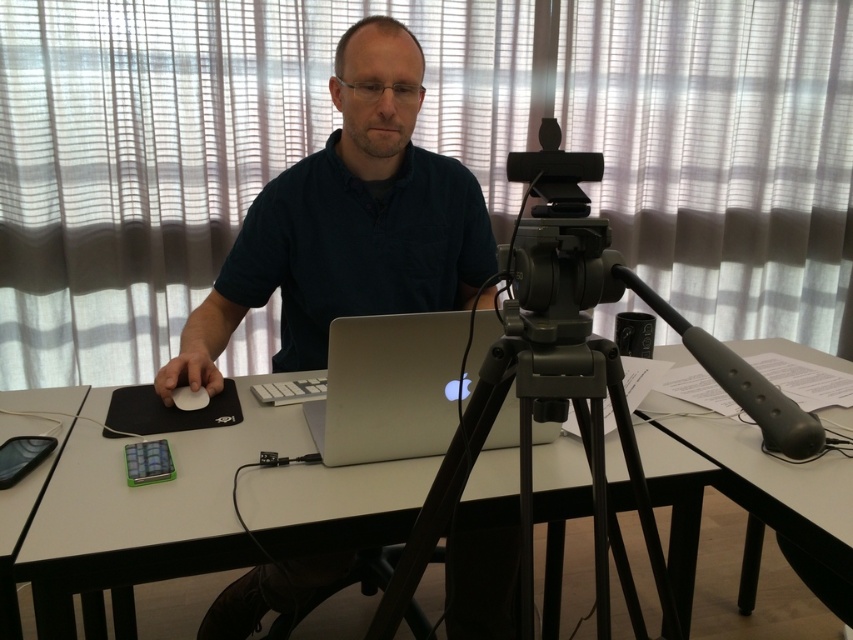
Looking at this image, you are organizing a photo album and want to place the dark blue shirt at center and the white paper at upper right side by side. Which one will take up more space in the album?

The dark blue shirt at center is larger in size than the white paper at upper right, so it will take up more space in the album.

You are standing in front of a desk setup and want to place a 12 inch wide notebook on the white glossy table at center. Can you fit it on the table without overlapping any edges?

The white glossy table at center and viewer are 39.05 inches apart. Since the notebook is 12 inches wide, it can fit on the table as the distance between you and the table does not affect the table width. Consider the table surface dimensions for placement.